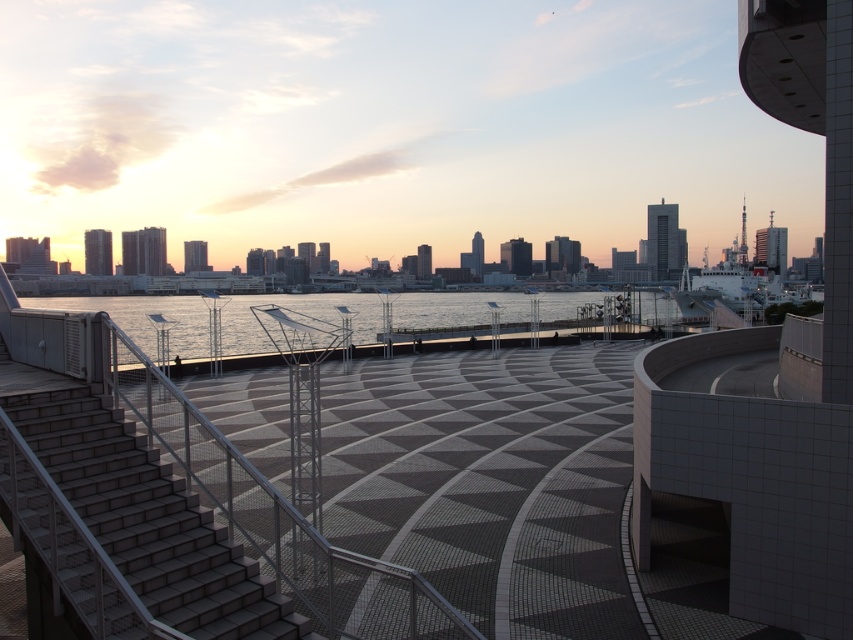
Is gray concrete stairs at lower left above clear water at center?

Actually, gray concrete stairs at lower left is below clear water at center.

Who is taller, gray concrete stairs at lower left or clear water at center?

With more height is clear water at center.

Describe the element at coordinates (148, 516) in the screenshot. I see `gray concrete stairs at lower left` at that location.

Where is `gray concrete stairs at lower left`? Image resolution: width=853 pixels, height=640 pixels. gray concrete stairs at lower left is located at coordinates (148, 516).